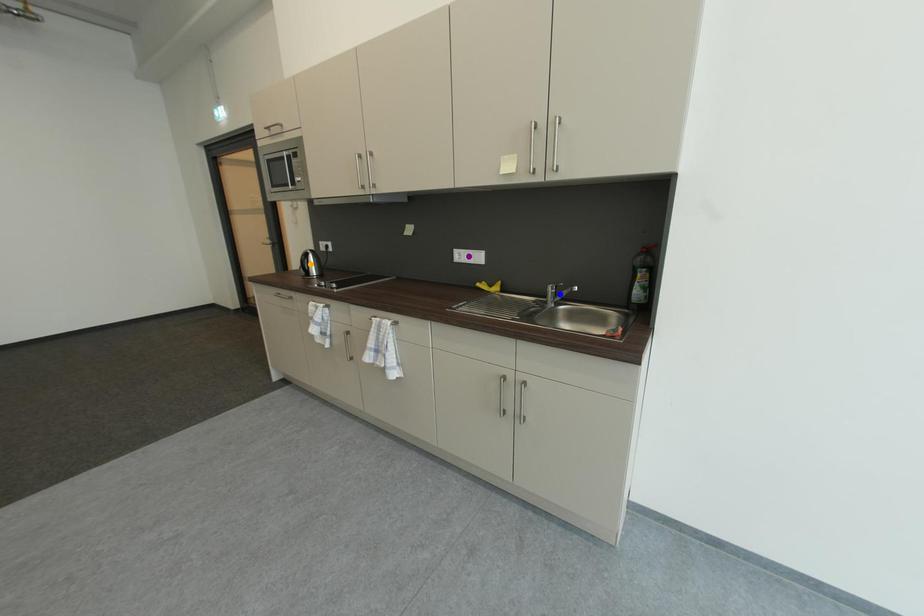
Order these from nearest to farthest:
- blue point
- orange point
- purple point

blue point → purple point → orange point